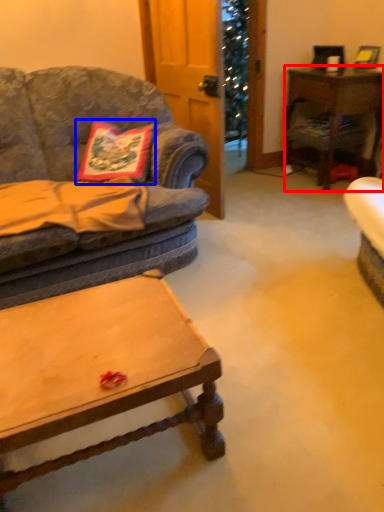
Question: Which object appears farthest to the camera in this image, desk (highlighted by a red box) or pillow (highlighted by a blue box)?

Choices:
 (A) desk
 (B) pillow

Answer: (A)